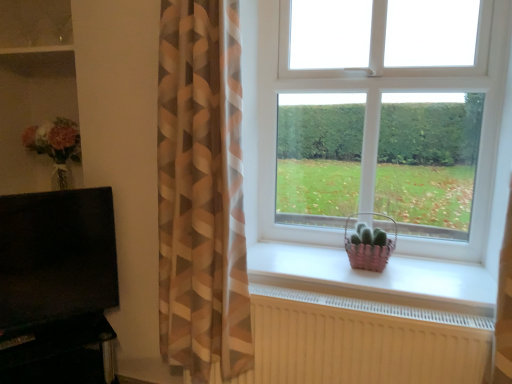
The image size is (512, 384). What do you see at coordinates (340, 229) in the screenshot?
I see `white plastic window at center` at bounding box center [340, 229].

Describe the element at coordinates (60, 352) in the screenshot. I see `black glossy entertainment center at lower left, which ranks as the 1th entertainment center in bottom-to-top order` at that location.

The image size is (512, 384). Find the location of `matte glass shelf at upper left`. matte glass shelf at upper left is located at coordinates (35, 23).

What is the approximate width of white matte window sill at center?

17.79 inches.

How much space does black matte tv at left, which is the 1th entertainment center from top to bottom, occupy horizontally?

It is 3.96 inches.

At what (x,y) coordinates should I click in order to perform the action: click on white textured radiator at lower center. Please return your answer as a coordinate pair (x, y). The width and height of the screenshot is (512, 384). Looking at the image, I should click on click(x=360, y=341).

Find the location of a particular element. the 1st entertainment center to the left when counting from the brown/white striped curtain at left is located at coordinates (60, 352).

Which of these two, black glossy entertainment center at lower left, arranged as the second entertainment center when viewed from the top, or brown/white striped curtain at left, stands shorter?

Standing shorter between the two is black glossy entertainment center at lower left, arranged as the second entertainment center when viewed from the top.

Does black glossy entertainment center at lower left, which ranks as the 1th entertainment center in bottom-to-top order, lie behind brown/white striped curtain at left?

Yes, the depth of black glossy entertainment center at lower left, which ranks as the 1th entertainment center in bottom-to-top order, is greater than that of brown/white striped curtain at left.

Which of these two, black glossy entertainment center at lower left, arranged as the second entertainment center when viewed from the top, or brown/white striped curtain at left, is smaller?

black glossy entertainment center at lower left, arranged as the second entertainment center when viewed from the top, is smaller.

Consider the image. From a real-world perspective, is white textured radiator at lower center physically located above or below pink woven basket at window?

white textured radiator at lower center is below pink woven basket at window.

Does white textured radiator at lower center lie in front of pink woven basket at window?

Yes, it is.

What's the angular difference between white textured radiator at lower center and pink woven basket at window's facing directions?

There is a 0.643-degree angle between the facing directions of white textured radiator at lower center and pink woven basket at window.

In terms of height, does white textured radiator at lower center look taller or shorter compared to pink woven basket at window?

Clearly, white textured radiator at lower center is taller compared to pink woven basket at window.

Considering the sizes of objects pink woven basket at window and white textured radiator at lower center in the image provided, who is thinner, pink woven basket at window or white textured radiator at lower center?

With smaller width is white textured radiator at lower center.

From a real-world perspective, is pink woven basket at window above or below white textured radiator at lower center?

In terms of real-world spatial position, pink woven basket at window is above white textured radiator at lower center.

From the image's perspective, is pink woven basket at window under white textured radiator at lower center?

Actually, pink woven basket at window appears above white textured radiator at lower center in the image.

Visually, is brown/white striped curtain at left positioned to the left or to the right of black matte tv at left, which is the 1th entertainment center from top to bottom?

brown/white striped curtain at left is positioned on black matte tv at left, which is the 1th entertainment center from top to bottom,'s right side.

Does brown/white striped curtain at left come behind black matte tv at left, arranged as the second entertainment center when ordered from the bottom?

No, the depth of brown/white striped curtain at left is less than that of black matte tv at left, arranged as the second entertainment center when ordered from the bottom.

Locate an element on the screen. This screenshot has width=512, height=384. curtain above the black matte tv at left, which is the 1th entertainment center from top to bottom (from a real-world perspective) is located at coordinates (202, 191).

Is brown/white striped curtain at left wider than black matte tv at left, which is the 1th entertainment center from top to bottom?

Yes.

Is there a large distance between white plastic window at center and pink woven basket at window?

They are positioned close to each other.

Is point (475, 196) closer or farther from the camera than point (395, 244)?

Point (475, 196) is positioned closer to the camera compared to point (395, 244).

Consider the image. Looking at their sizes, would you say white plastic window at center is wider or thinner than pink woven basket at window?

white plastic window at center is thinner than pink woven basket at window.

Does matte glass shelf at upper left have a smaller size compared to brown/white striped curtain at left?

Indeed, matte glass shelf at upper left has a smaller size compared to brown/white striped curtain at left.

Measure the distance between matte glass shelf at upper left and brown/white striped curtain at left.

matte glass shelf at upper left is 1.29 meters away from brown/white striped curtain at left.

Considering their positions, is matte glass shelf at upper left located in front of or behind brown/white striped curtain at left?

In the image, matte glass shelf at upper left appears behind brown/white striped curtain at left.

From the image's perspective, is white matte window sill at center under black glossy entertainment center at lower left, arranged as the second entertainment center when viewed from the top?

Actually, white matte window sill at center appears above black glossy entertainment center at lower left, arranged as the second entertainment center when viewed from the top, in the image.

Which is more to the right, white matte window sill at center or black glossy entertainment center at lower left, which ranks as the 1th entertainment center in bottom-to-top order?

Positioned to the right is white matte window sill at center.

From a real-world perspective, is white matte window sill at center positioned above or below black glossy entertainment center at lower left, arranged as the second entertainment center when viewed from the top?

white matte window sill at center is above black glossy entertainment center at lower left, arranged as the second entertainment center when viewed from the top.

Based on the photo, is white matte window sill at center far from black glossy entertainment center at lower left, which ranks as the 1th entertainment center in bottom-to-top order?

Yes, white matte window sill at center and black glossy entertainment center at lower left, which ranks as the 1th entertainment center in bottom-to-top order, are quite far apart.

Identify the location of curtain on the right of black glossy entertainment center at lower left, arranged as the second entertainment center when viewed from the top. (202, 191).

At what (x,y) coordinates should I click in order to perform the action: click on radiator lying in front of the pink woven basket at window. Please return your answer as a coordinate pair (x, y). Looking at the image, I should click on (360, 341).

Looking at the image, which one is located further to brown/white striped curtain at left, black glossy entertainment center at lower left, arranged as the second entertainment center when viewed from the top, or white plastic window at center?

Among the two, black glossy entertainment center at lower left, arranged as the second entertainment center when viewed from the top, is located further to brown/white striped curtain at left.

When comparing their distances from black matte tv at left, which is the 1th entertainment center from top to bottom, does black glossy entertainment center at lower left, which ranks as the 1th entertainment center in bottom-to-top order, or brown/white striped curtain at left seem closer?

black glossy entertainment center at lower left, which ranks as the 1th entertainment center in bottom-to-top order, is closer to black matte tv at left, which is the 1th entertainment center from top to bottom.

Looking at the image, which one is located closer to pink woven basket at window, white matte window sill at center or brown/white striped curtain at left?

white matte window sill at center lies closer to pink woven basket at window than the other object.

Looking at the image, which one is located closer to matte glass shelf at upper left, white plastic window at center or white matte window sill at center?

white plastic window at center.

In the scene shown: Which object lies further to the anchor point white textured radiator at lower center, black matte tv at left, arranged as the second entertainment center when ordered from the bottom, or brown/white striped curtain at left?

black matte tv at left, arranged as the second entertainment center when ordered from the bottom, lies further to white textured radiator at lower center than the other object.

Based on their spatial positions, is brown/white striped curtain at left or black glossy entertainment center at lower left, arranged as the second entertainment center when viewed from the top, closer to black matte tv at left, which is the 1th entertainment center from top to bottom?

black glossy entertainment center at lower left, arranged as the second entertainment center when viewed from the top, lies closer to black matte tv at left, which is the 1th entertainment center from top to bottom, than the other object.

From the image, which object appears to be farther from white plastic window at center, white matte window sill at center or black matte tv at left, which is the 1th entertainment center from top to bottom?

A: black matte tv at left, which is the 1th entertainment center from top to bottom, is further to white plastic window at center.

Which object lies further to the anchor point black matte tv at left, arranged as the second entertainment center when ordered from the bottom, brown/white striped curtain at left or white plastic window at center?

Among the two, white plastic window at center is located further to black matte tv at left, arranged as the second entertainment center when ordered from the bottom.

Locate an element on the screen. The height and width of the screenshot is (384, 512). curtain between black matte tv at left, arranged as the second entertainment center when ordered from the bottom, and white textured radiator at lower center from left to right is located at coordinates (202, 191).

Where is `radiator between matte glass shelf at upper left and white plastic window at center`? This screenshot has width=512, height=384. radiator between matte glass shelf at upper left and white plastic window at center is located at coordinates (360, 341).

You are a GUI agent. You are given a task and a screenshot of the screen. Output one action in this format:
    pyautogui.click(x=<x>, y=<y>)
    Task: Click on the entertainment center that lies between brown/white striped curtain at left and black glossy entertainment center at lower left, arranged as the second entertainment center when viewed from the top, from top to bottom
    The width and height of the screenshot is (512, 384).
    Given the screenshot: What is the action you would take?
    pyautogui.click(x=57, y=287)

Identify the location of window sill between pink woven basket at window and white textured radiator at lower center in the vertical direction. [x=375, y=278].